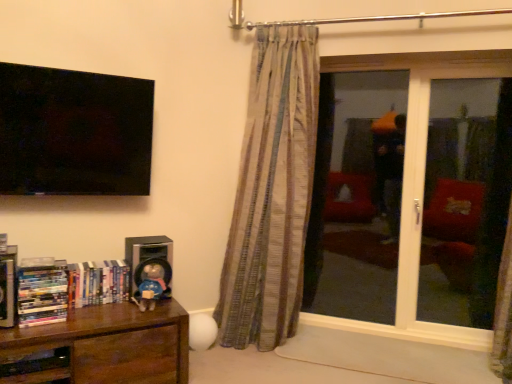
At what (x,y) coordinates should I click in order to perform the action: click on vacant space to the right of multicolored plastic books at lower left, which appears as the 2th book when viewed from the left. Please return your answer as a coordinate pair (x, y). The height and width of the screenshot is (384, 512). Looking at the image, I should click on (92, 312).